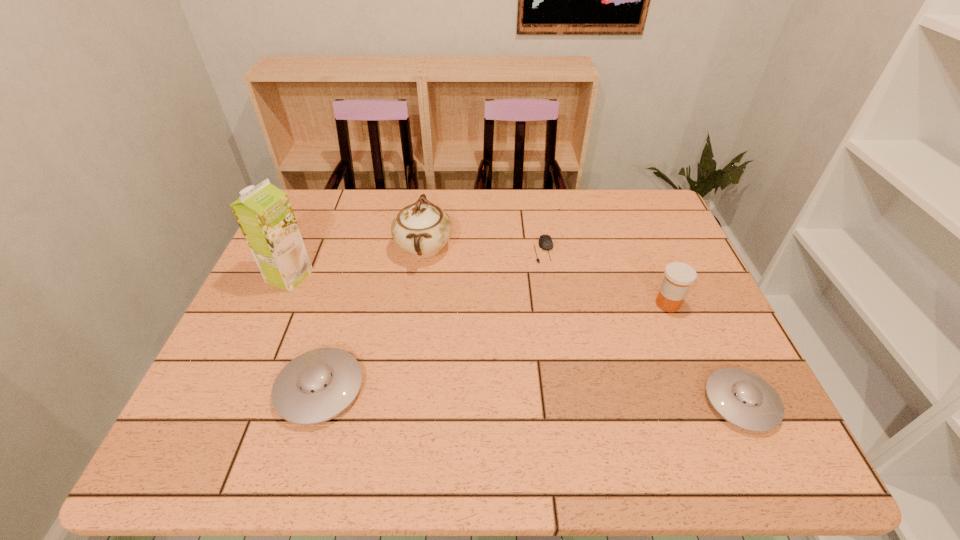
You are a GUI agent. You are given a task and a screenshot of the screen. Output one action in this format:
    pyautogui.click(x=<x>, y=<y>)
    Task: Click on the free region at the right edge
    The image size is (960, 540).
    Given the screenshot: What is the action you would take?
    pyautogui.click(x=672, y=367)

Image resolution: width=960 pixels, height=540 pixels. In the image, there is a desktop. In order to click on vacant space at the far left corner in this screenshot , I will do `click(311, 198)`.

Where is `unoccupied area between the left saucer and the fourth shortest object`? This screenshot has height=540, width=960. unoccupied area between the left saucer and the fourth shortest object is located at coordinates (493, 346).

Locate an element on the screen. unoccupied position between the fourth object from left to right and the tallest object is located at coordinates (417, 263).

Find the location of a particular element. The image size is (960, 540). free point between the left saucer and the leftmost object is located at coordinates (304, 333).

The width and height of the screenshot is (960, 540). Find the location of `vacant area that lies between the second tallest object and the fifth object from right to left`. vacant area that lies between the second tallest object and the fifth object from right to left is located at coordinates (372, 319).

The height and width of the screenshot is (540, 960). In order to click on vacant space that is in between the right saucer and the leftmost object in this screenshot , I will do `click(516, 339)`.

Find the location of a particular element. This screenshot has height=540, width=960. free space between the mouse and the right saucer is located at coordinates (642, 326).

This screenshot has height=540, width=960. Identify the location of vacant area that lies between the left saucer and the second shortest object. (531, 396).

What are the coordinates of `empty space between the fourth farthest object and the tallest object` in the screenshot? It's located at (478, 290).